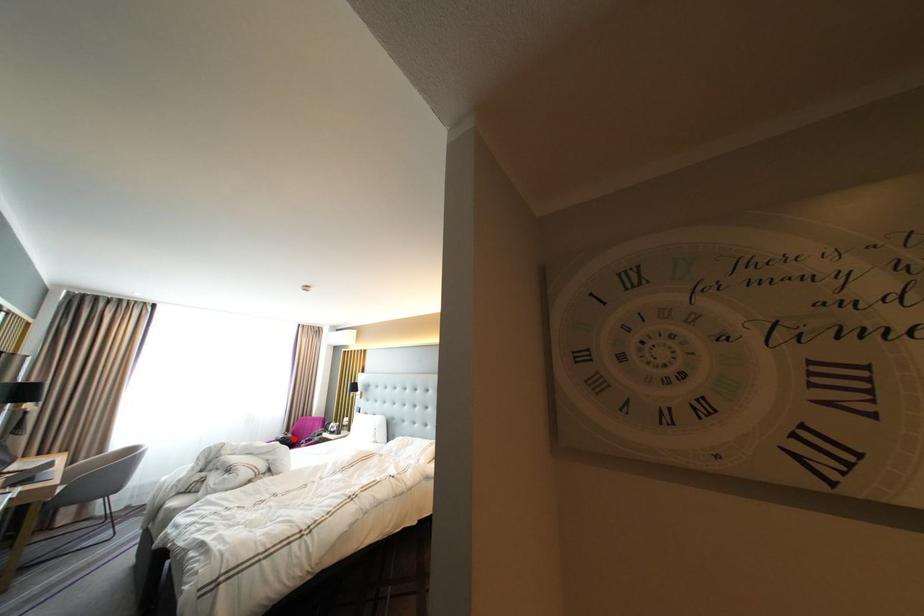
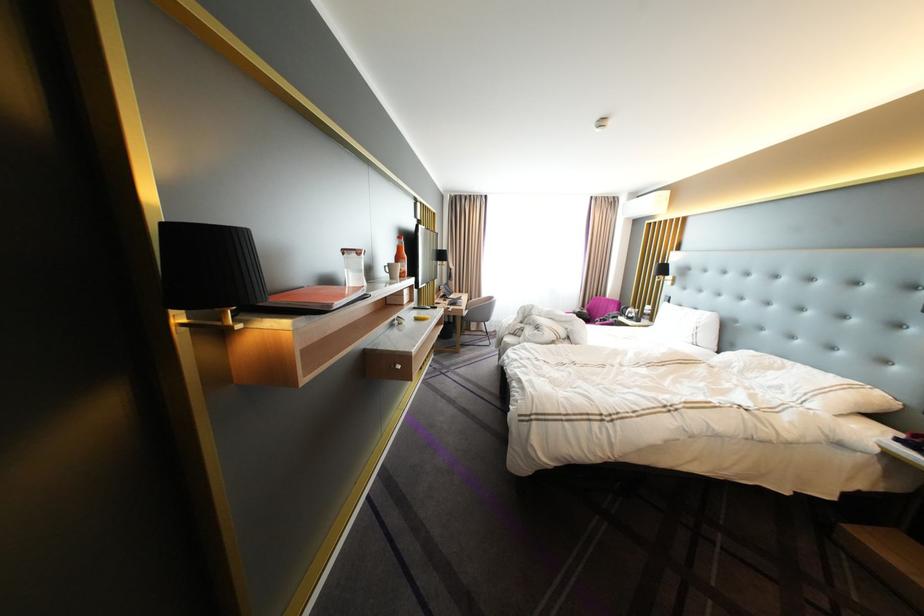
Question: I am providing you with two images of the same scene from different viewpoints. Given a red point in image1, look at the same physical point in image2. Is it:

Choices:
 (A) Closer to the viewpoint
 (B) Farther from the viewpoint

Answer: (B)